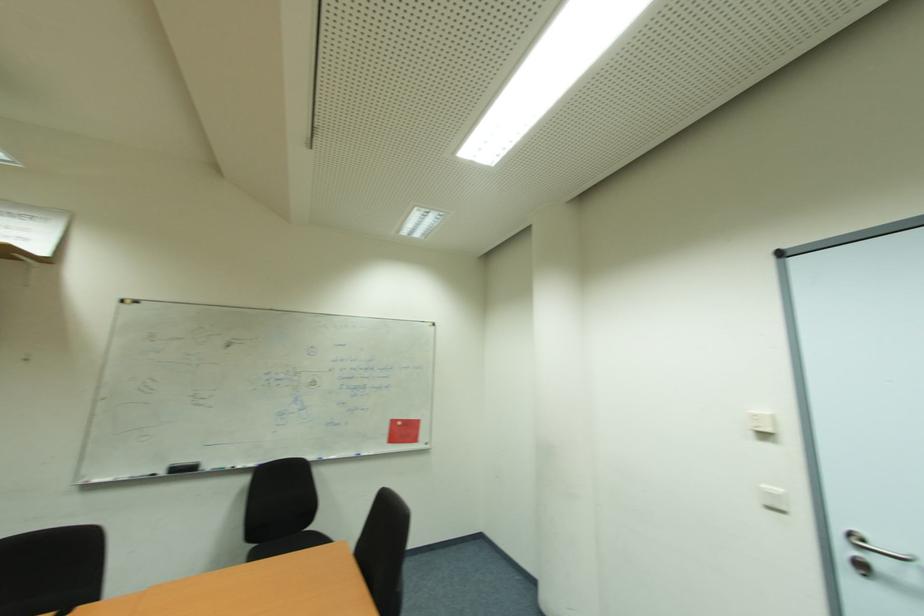
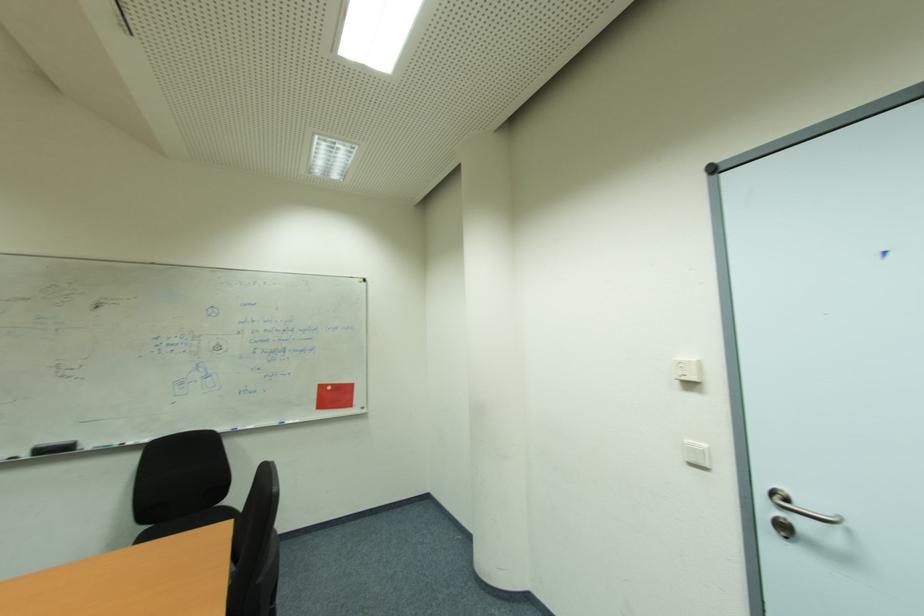
From the picture: In a continuous first-person perspective shot, in which direction is the camera moving?

The cameraman walked toward right, forward.